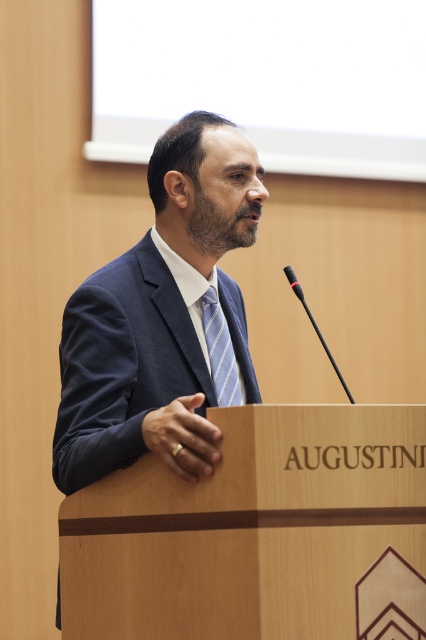
You are a photographer setting up for a presentation. You need to ensure that the dark blue suit at center and the black matte microphone at center are both visible in your shot. Which object takes up more horizontal space in the image?

The dark blue suit at center takes up more horizontal space than the black matte microphone at center because its width surpasses the microphone.

You are an event organizer who needs to adjust the microphone placement so that the black plastic microphone at center is exactly 20 centimeters away from the striped fabric tie at center. Based on the current setup, should you move the microphone closer to or farther away from the tie?

The striped fabric tie at center and black plastic microphone at center are currently 19.92 centimeters apart. Since 19.92 cm is slightly less than 20 cm, you should move the microphone slightly farther away from the tie to reach the desired distance.